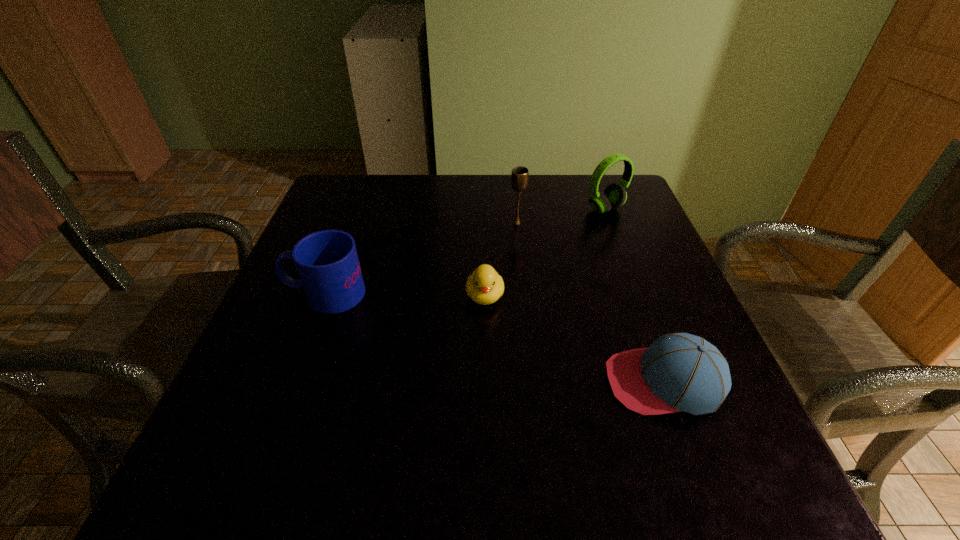
This screenshot has width=960, height=540. I want to click on the farthest object, so click(614, 196).

In order to click on the fourth nearest object in this screenshot , I will do `click(519, 176)`.

The height and width of the screenshot is (540, 960). I want to click on the third object from right to left, so click(x=519, y=176).

Identify the location of mug. (327, 262).

What are the coordinates of `the leftmost object` in the screenshot? It's located at [x=327, y=262].

Image resolution: width=960 pixels, height=540 pixels. I want to click on baseball cap, so (x=678, y=372).

Locate an element on the screen. The height and width of the screenshot is (540, 960). the fourth object from right to left is located at coordinates (484, 286).

The height and width of the screenshot is (540, 960). I want to click on free space located on the left of the farthest object, so click(457, 209).

Locate an element on the screen. The width and height of the screenshot is (960, 540). free space located on the front of the second farthest object is located at coordinates (530, 345).

Locate an element on the screen. This screenshot has height=540, width=960. free location located on the front-facing side of the baseball cap is located at coordinates (481, 382).